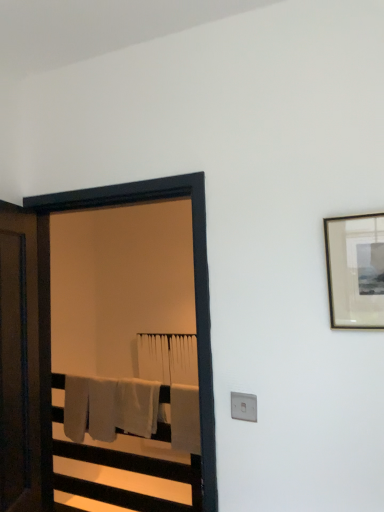
Looking at this image, measure the distance between matte black picture frame at upper right and camera.

The distance of matte black picture frame at upper right from camera is 1.18 meters.

Where is `black wooden screen door at left`? This screenshot has width=384, height=512. black wooden screen door at left is located at coordinates (194, 277).

Could white soft bath towel at center, marked as the second bath towel in a back-to-front arrangement, be considered to be inside brown wooden door at left?

No, brown wooden door at left does not contain white soft bath towel at center, marked as the second bath towel in a back-to-front arrangement.

Is brown wooden door at left positioned far away from white soft bath towel at center, which ranks as the second bath towel in front-to-back order?

brown wooden door at left is positioned a significant distance from white soft bath towel at center, which ranks as the second bath towel in front-to-back order.

How many degrees apart are the facing directions of brown wooden door at left and white soft bath towel at center, marked as the second bath towel in a back-to-front arrangement?

112 degrees separate the facing orientations of brown wooden door at left and white soft bath towel at center, marked as the second bath towel in a back-to-front arrangement.

Who is shorter, brown wooden door at left or white soft bath towel at center, which ranks as the second bath towel in front-to-back order?

Standing shorter between the two is white soft bath towel at center, which ranks as the second bath towel in front-to-back order.

What are the coordinates of `electric outlet above the white cotton bath towel at center, which is the 3th bath towel from back to front (from a real-world perspective)` in the screenshot? It's located at (244, 406).

Is the surface of white cotton bath towel at center, which is the 3th bath towel from back to front, in direct contact with white plastic electric outlet at lower center?

No, white cotton bath towel at center, which is the 3th bath towel from back to front, is not next to white plastic electric outlet at lower center.

What's the angular difference between white cotton bath towel at center, which is the 3th bath towel from back to front, and white plastic electric outlet at lower center's facing directions?

The angle between the facing direction of white cotton bath towel at center, which is the 3th bath towel from back to front, and the facing direction of white plastic electric outlet at lower center is 2.12 degrees.

Is white cotton bath towel at center, which is the 3th bath towel from back to front, positioned before white plastic electric outlet at lower center?

No, it is not.

Where is `bath towel that is the 2nd object directly below the brown wooden door at left (from a real-world perspective)`? This screenshot has height=512, width=384. bath towel that is the 2nd object directly below the brown wooden door at left (from a real-world perspective) is located at coordinates (185, 418).

Which object is further away from the camera, white cotton bath towel at center, which ranks as the first bath towel in front-to-back order, or brown wooden door at left?

Positioned behind is white cotton bath towel at center, which ranks as the first bath towel in front-to-back order.

Consider the image. From the image's perspective, relative to brown wooden door at left, is white cotton bath towel at center, which ranks as the first bath towel in front-to-back order, above or below?

white cotton bath towel at center, which ranks as the first bath towel in front-to-back order, is below brown wooden door at left.

From the picture: From a real-world perspective, between white cotton bath towel at center, which ranks as the first bath towel in front-to-back order, and brown wooden door at left, who is vertically lower?

In real-world perspective, white cotton bath towel at center, which ranks as the first bath towel in front-to-back order, is lower.

Image resolution: width=384 pixels, height=512 pixels. I want to click on bath towel above the white cotton bath towel at center, which ranks as the first bath towel in front-to-back order (from a real-world perspective), so click(x=168, y=357).

Between point (187, 349) and point (189, 397), which one is positioned behind?

Point (187, 349)

Based on the photo, considering the sizes of white cotton bath towel at center, arranged as the first bath towel when viewed from the back, and white cotton bath towel at center, which is the 3th bath towel from back to front, in the image, is white cotton bath towel at center, arranged as the first bath towel when viewed from the back, taller or shorter than white cotton bath towel at center, which is the 3th bath towel from back to front,?

Considering their sizes, white cotton bath towel at center, arranged as the first bath towel when viewed from the back, has less height than white cotton bath towel at center, which is the 3th bath towel from back to front.

Looking at this image, is white cotton bath towel at center, marked as the third bath towel in a front-to-back arrangement, outside of white cotton bath towel at center, which is the 3th bath towel from back to front?

Yes, white cotton bath towel at center, marked as the third bath towel in a front-to-back arrangement, is not within white cotton bath towel at center, which is the 3th bath towel from back to front.

Could you tell me if matte black picture frame at upper right is turned towards white cotton bath towel at center, which is the 3th bath towel from back to front?

No, matte black picture frame at upper right is not facing towards white cotton bath towel at center, which is the 3th bath towel from back to front.

Would you say matte black picture frame at upper right is inside or outside white cotton bath towel at center, which ranks as the first bath towel in front-to-back order?

matte black picture frame at upper right is spatially situated outside white cotton bath towel at center, which ranks as the first bath towel in front-to-back order.

Is matte black picture frame at upper right far from white cotton bath towel at center, which ranks as the first bath towel in front-to-back order?

matte black picture frame at upper right is far away from white cotton bath towel at center, which ranks as the first bath towel in front-to-back order.

From the image's perspective, is brown wooden door at left above or below black wooden screen door at left?

Based on their image positions, brown wooden door at left is located beneath black wooden screen door at left.

Considering the sizes of brown wooden door at left and black wooden screen door at left in the image, is brown wooden door at left wider or thinner than black wooden screen door at left?

brown wooden door at left is thinner than black wooden screen door at left.

Which is more to the left, brown wooden door at left or black wooden screen door at left?

brown wooden door at left is more to the left.

Could you tell me if brown wooden door at left is turned towards black wooden screen door at left?

Yes, brown wooden door at left is turned towards black wooden screen door at left.

Which of these two, black wooden screen door at left or white cotton bath towel at center, marked as the third bath towel in a front-to-back arrangement, is bigger?

With larger size is black wooden screen door at left.

Can you tell me how much black wooden screen door at left and white cotton bath towel at center, marked as the third bath towel in a front-to-back arrangement, differ in facing direction?

0.334 degrees separate the facing orientations of black wooden screen door at left and white cotton bath towel at center, marked as the third bath towel in a front-to-back arrangement.

Can you confirm if black wooden screen door at left is positioned to the right of white cotton bath towel at center, arranged as the first bath towel when viewed from the back?

Incorrect, black wooden screen door at left is not on the right side of white cotton bath towel at center, arranged as the first bath towel when viewed from the back.

From the image's perspective, who appears lower, black wooden screen door at left or white cotton bath towel at center, arranged as the first bath towel when viewed from the back?

white cotton bath towel at center, arranged as the first bath towel when viewed from the back.

Locate an element on the screen. This screenshot has width=384, height=512. the 1st bath towel to the right of the brown wooden door at left, starting your count from the anchor is located at coordinates (109, 407).

Identify the location of electric outlet lying above the white cotton bath towel at center, which ranks as the first bath towel in front-to-back order (from the image's perspective). The image size is (384, 512). (244, 406).

Based on their spatial positions, is white plastic electric outlet at lower center or black wooden screen door at left closer to white soft bath towel at center, marked as the second bath towel in a back-to-front arrangement?

Among the two, black wooden screen door at left is located nearer to white soft bath towel at center, marked as the second bath towel in a back-to-front arrangement.

Based on their spatial positions, is white plastic electric outlet at lower center or white cotton bath towel at center, which is the 3th bath towel from back to front, further from white soft bath towel at center, which ranks as the second bath towel in front-to-back order?

Based on the image, white plastic electric outlet at lower center appears to be further to white soft bath towel at center, which ranks as the second bath towel in front-to-back order.

From the image, which object appears to be farther from white plastic electric outlet at lower center, white cotton bath towel at center, arranged as the first bath towel when viewed from the back, or matte black picture frame at upper right?

white cotton bath towel at center, arranged as the first bath towel when viewed from the back.

From the image, which object appears to be farther from matte black picture frame at upper right, white cotton bath towel at center, which is the 3th bath towel from back to front, or white cotton bath towel at center, arranged as the first bath towel when viewed from the back?

white cotton bath towel at center, arranged as the first bath towel when viewed from the back, lies further to matte black picture frame at upper right than the other object.

When comparing their distances from black wooden screen door at left, does brown wooden door at left or white cotton bath towel at center, marked as the third bath towel in a front-to-back arrangement, seem further?

white cotton bath towel at center, marked as the third bath towel in a front-to-back arrangement, lies further to black wooden screen door at left than the other object.

Estimate the real-world distances between objects in this image. Which object is further from black wooden screen door at left, brown wooden door at left or matte black picture frame at upper right?

matte black picture frame at upper right is positioned further to the anchor black wooden screen door at left.

Looking at the image, which one is located further to white cotton bath towel at center, marked as the third bath towel in a front-to-back arrangement, matte black picture frame at upper right or white plastic electric outlet at lower center?

matte black picture frame at upper right is further to white cotton bath towel at center, marked as the third bath towel in a front-to-back arrangement.

Estimate the real-world distances between objects in this image. Which object is closer to black wooden screen door at left, brown wooden door at left or white plastic electric outlet at lower center?

white plastic electric outlet at lower center is closer to black wooden screen door at left.

Locate an element on the screen. electric outlet located between brown wooden door at left and white cotton bath towel at center, arranged as the first bath towel when viewed from the back, in the depth direction is located at coordinates (244, 406).

At what (x,y) coordinates should I click in order to perform the action: click on electric outlet situated between brown wooden door at left and matte black picture frame at upper right from left to right. Please return your answer as a coordinate pair (x, y). The width and height of the screenshot is (384, 512). Looking at the image, I should click on (244, 406).

Image resolution: width=384 pixels, height=512 pixels. I want to click on screen door between white plastic electric outlet at lower center and white soft bath towel at center, which ranks as the second bath towel in front-to-back order, along the z-axis, so click(x=194, y=277).

The image size is (384, 512). In order to click on screen door between matte black picture frame at upper right and white cotton bath towel at center, which is the 3th bath towel from back to front, in the front-back direction in this screenshot , I will do `click(194, 277)`.